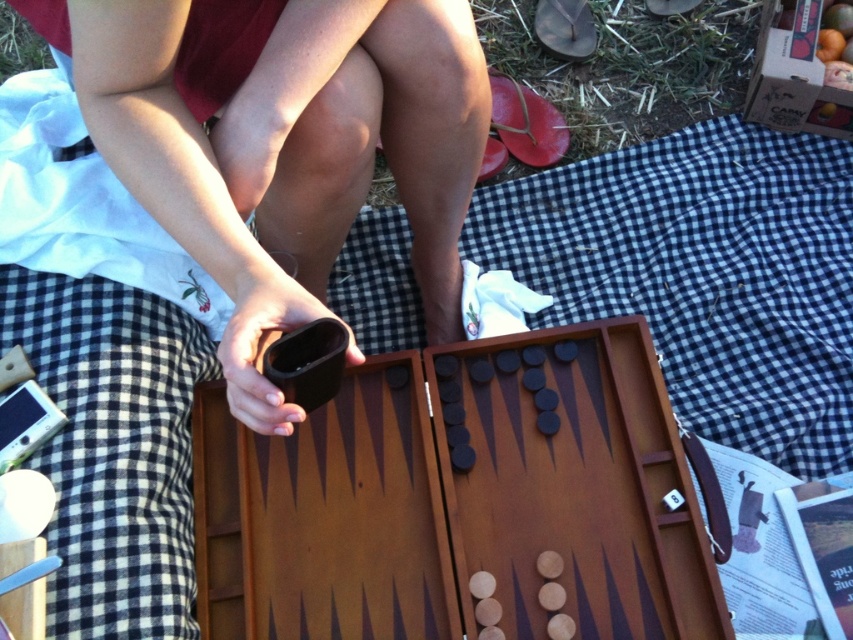
You are setting up a backgammon game and notice two boards labeled as matte brown backgammon board at center and brown wooden backgammon board at center. Which one is placed on top of the other?

The matte brown backgammon board at center is positioned over the brown wooden backgammon board at center, so it is placed on top of it.

Based on the photo, you are observing a backgammon game and see the matte brown backgammon board at center and the brown wooden backgammon board at center. Which one is positioned more to the left?

The matte brown backgammon board at center is positioned more to the left than the brown wooden backgammon board at center.